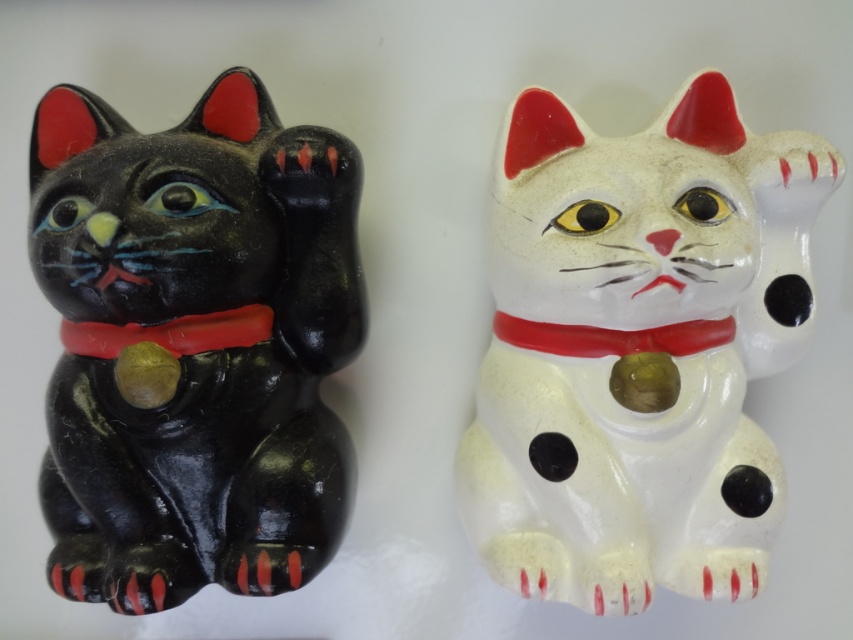
Can you confirm if white glossy cat at upper center is wider than rubber-like red neckband at left?

Correct, the width of white glossy cat at upper center exceeds that of rubber-like red neckband at left.

Between white glossy cat at upper center and rubber-like red neckband at left, which one has more height?

white glossy cat at upper center

Is point (714, 195) closer to camera compared to point (70, 330)?

Yes.

This screenshot has height=640, width=853. I want to click on white glossy cat at upper center, so click(637, 349).

Is red glossy neckband at center taller than rubber-like red neckband at left?

Incorrect, red glossy neckband at center's height is not larger of rubber-like red neckband at left's.

Is point (636, 333) less distant than point (112, 337)?

No.

What do you see at coordinates (612, 337) in the screenshot? The width and height of the screenshot is (853, 640). I see `red glossy neckband at center` at bounding box center [612, 337].

I want to click on red glossy neckband at center, so click(612, 337).

Does white glossy cat at upper center have a larger size compared to red glossy neckband at center?

Correct, white glossy cat at upper center is larger in size than red glossy neckband at center.

Looking at this image, can you confirm if white glossy cat at upper center is thinner than red glossy neckband at center?

Incorrect, white glossy cat at upper center's width is not less than red glossy neckband at center's.

The width and height of the screenshot is (853, 640). Describe the element at coordinates (637, 349) in the screenshot. I see `white glossy cat at upper center` at that location.

Find the location of `white glossy cat at upper center`. white glossy cat at upper center is located at coordinates 637,349.